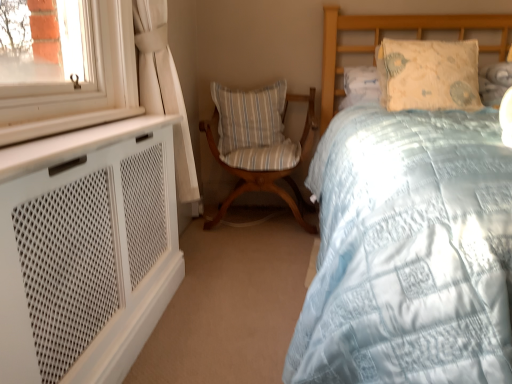
Question: From a real-world perspective, relative to woodenchair at center, is striped fabric pillow at center, the 2th pillow when ordered from right to left, vertically above or below?

Choices:
 (A) below
 (B) above

Answer: (B)

Question: Looking at the image, does striped fabric pillow at center, the 1th pillow when ordered from left to right, seem bigger or smaller compared to woodenchair at center?

Choices:
 (A) big
 (B) small

Answer: (B)

Question: Considering the real-world distances, which object is closest to the light blue quilted bed at center?

Choices:
 (A) woodenchair at center
 (B) light blue quilted pillow at upper right, the second pillow viewed from the back
 (C) striped fabric pillow at center, which is the 2th pillow in front-to-back order

Answer: (B)

Question: Which object is positioned closest to the light blue quilted pillow at upper right, positioned as the 2th pillow in left-to-right order?

Choices:
 (A) light blue quilted bed at center
 (B) striped fabric pillow at center, the 1th pillow when ordered from left to right
 (C) woodenchair at center

Answer: (A)